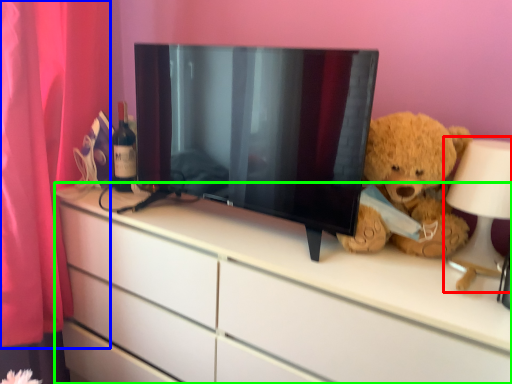
Question: Which object is positioned closest to table lamp (highlighted by a red box)? Select from curtain (highlighted by a blue box) and chest of drawers (highlighted by a green box).

Choices:
 (A) curtain
 (B) chest of drawers

Answer: (B)